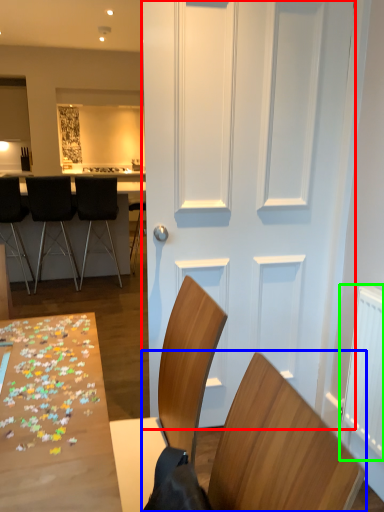
Question: Considering the real-world distances, which object is closest to door (highlighted by a red box)? chair (highlighted by a blue box) or radiator (highlighted by a green box).

Choices:
 (A) chair
 (B) radiator

Answer: (B)